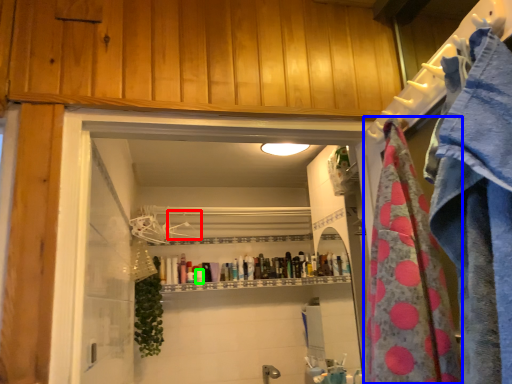
Question: Considering the real-world distances, which object is farthest from hanger (highlighted by a red box)? beach towel (highlighted by a blue box) or toiletry (highlighted by a green box)?

Choices:
 (A) beach towel
 (B) toiletry

Answer: (A)